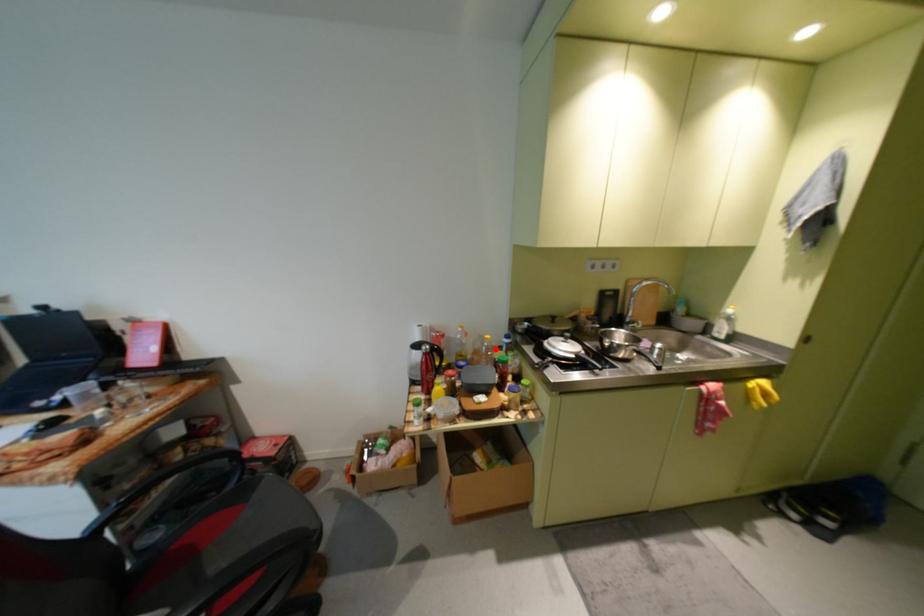
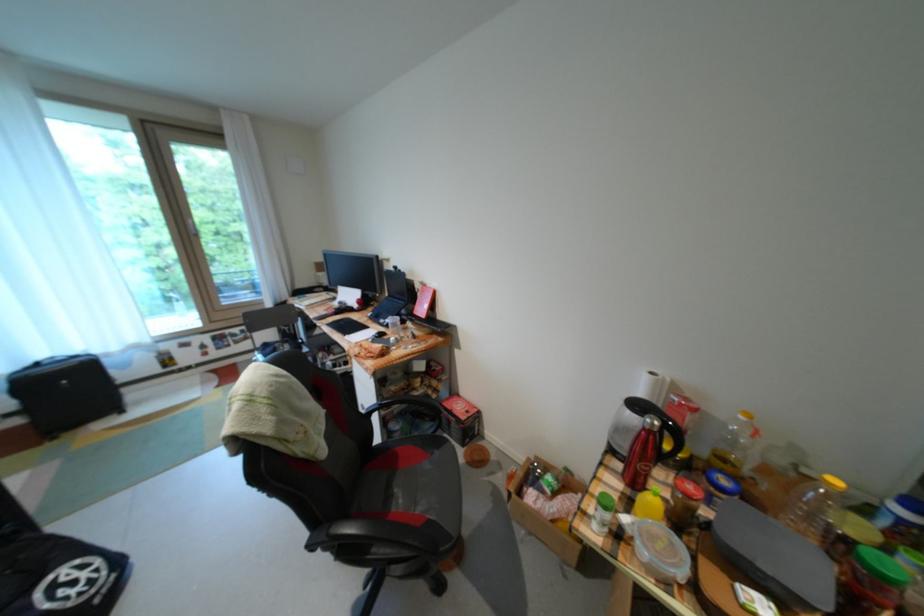
Locate, in the second image, the point that corresponds to the highlighted location in the first image.

(821, 495)